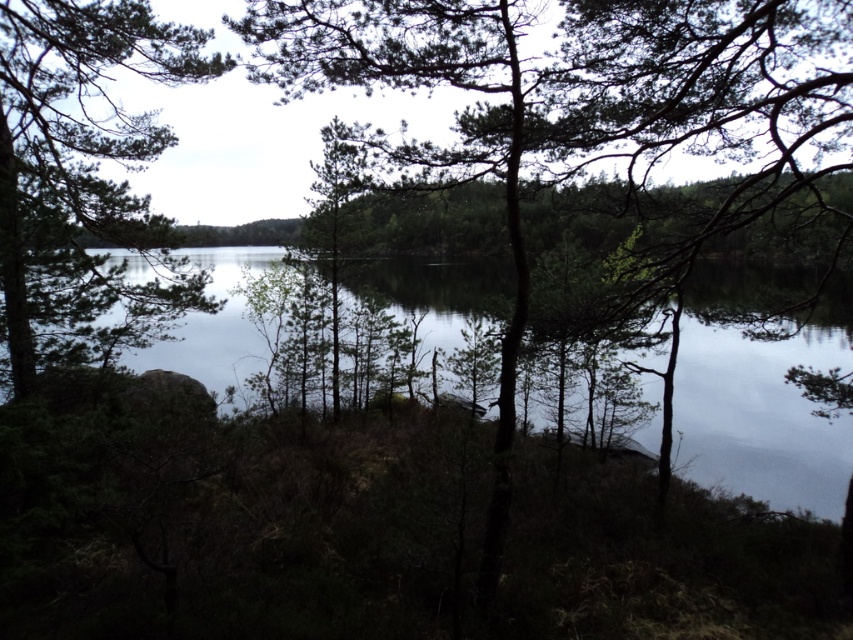
Question: Is green matte tree at left bigger than transparent water at center?

Choices:
 (A) yes
 (B) no

Answer: (B)

Question: Is green matte tree at left positioned before transparent water at center?

Choices:
 (A) no
 (B) yes

Answer: (A)

Question: Can you confirm if green matte tree at left is positioned to the right of transparent water at center?

Choices:
 (A) yes
 (B) no

Answer: (B)